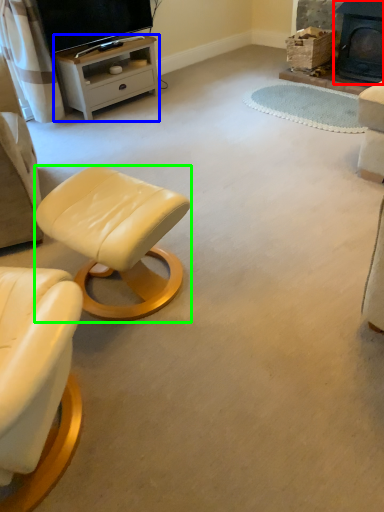
Question: Which object is positioned farthest from fireplace (highlighted by a red box)? Select from desk (highlighted by a blue box) and stool (highlighted by a green box).

Choices:
 (A) desk
 (B) stool

Answer: (B)